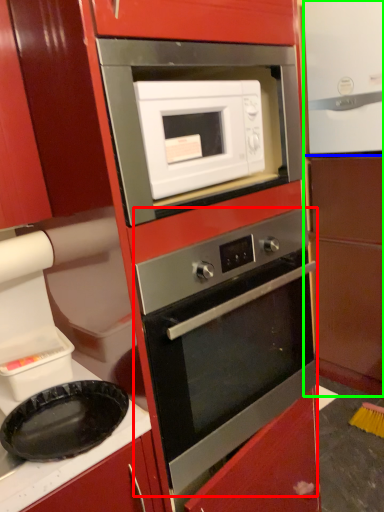
Question: Estimate the real-world distances between objects in this image. Which object is closer to oven (highlighted by a red box), appliance (highlighted by a blue box) or cabinetry (highlighted by a green box)?

Choices:
 (A) appliance
 (B) cabinetry

Answer: (B)